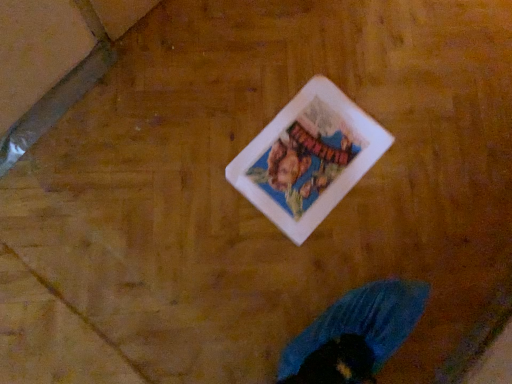
Where is `free space above white glossy comic book at center (from a real-world perspective)`? The image size is (512, 384). free space above white glossy comic book at center (from a real-world perspective) is located at coordinates (312, 148).